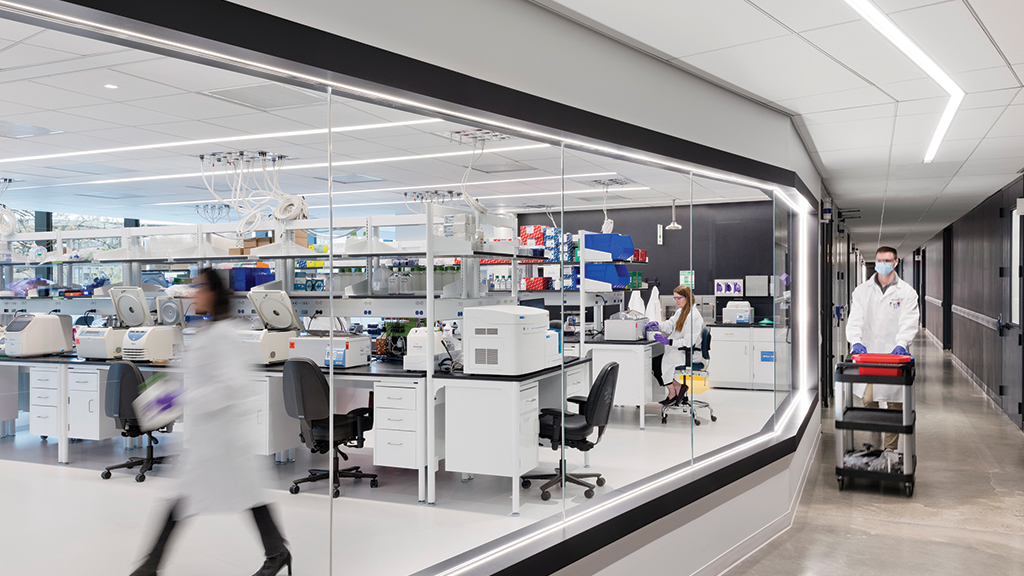
Locate an element on the screen. blue cubbies is located at coordinates point(606,245), point(606,267).